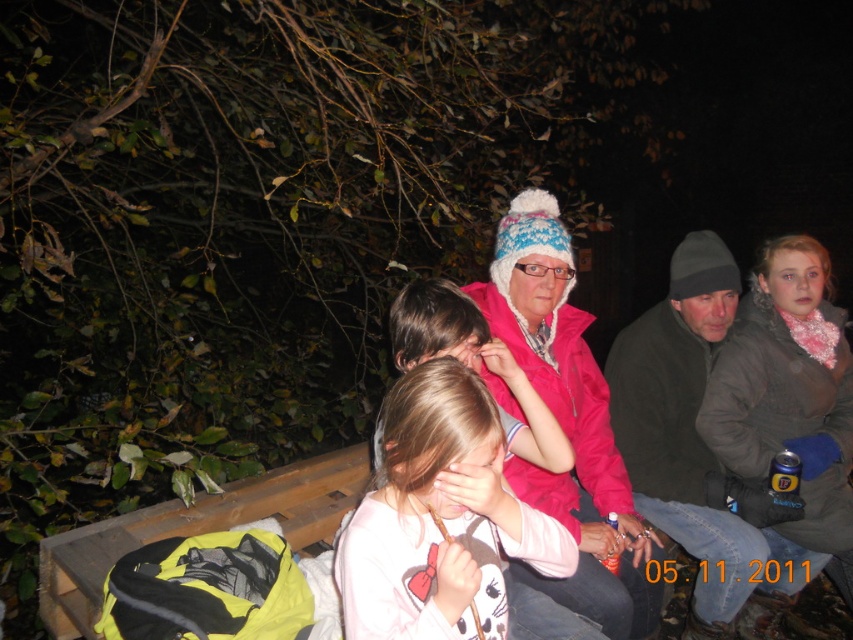
Question: Does dark gray knit hat at right have a smaller size compared to brown fuzzy jacket at upper right?

Choices:
 (A) yes
 (B) no

Answer: (A)

Question: Considering the relative positions of dark gray knit hat at right and brown fuzzy jacket at upper right in the image provided, where is dark gray knit hat at right located with respect to brown fuzzy jacket at upper right?

Choices:
 (A) above
 (B) below

Answer: (A)

Question: Among these points, which one is farthest from the camera?

Choices:
 (A) (627, 408)
 (B) (792, 269)
 (C) (619, 508)

Answer: (B)

Question: Where is dark gray knit hat at right located in relation to brown fuzzy jacket at upper right in the image?

Choices:
 (A) above
 (B) below

Answer: (A)

Question: Which point is closer to the camera taking this photo?

Choices:
 (A) (753, 522)
 (B) (624, 620)

Answer: (B)

Question: Which object is farther from the camera taking this photo?

Choices:
 (A) brown fuzzy jacket at upper right
 (B) dark gray knit hat at right

Answer: (A)